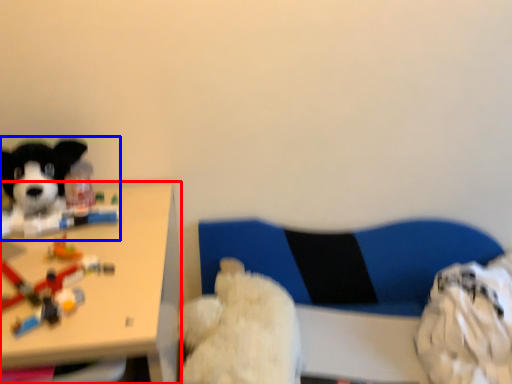
Question: Which of the following is the closest to the observer, table (highlighted by a red box) or dog (highlighted by a blue box)?

Choices:
 (A) table
 (B) dog

Answer: (A)